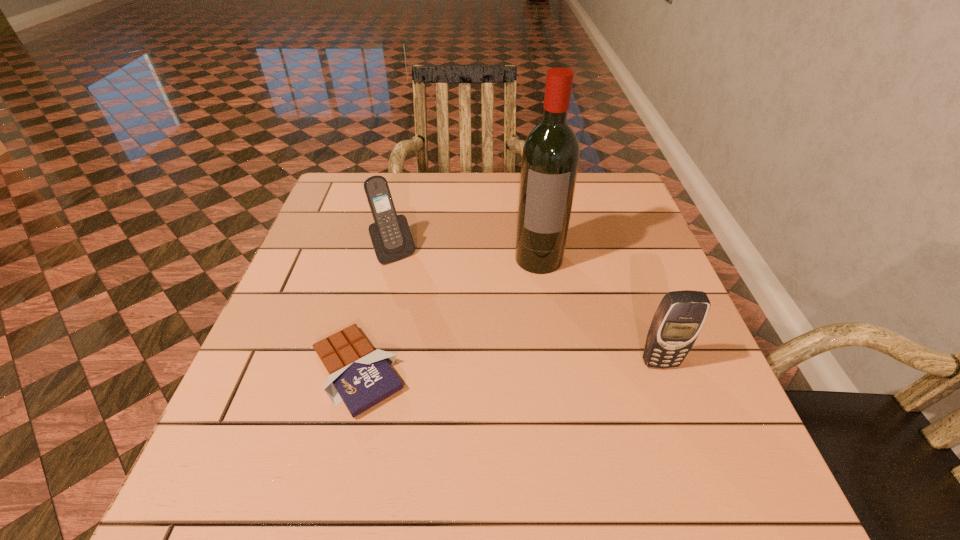
Locate an element on the screen. vacant space on the desktop that is between the chocolate bar and the right cellular telephone and is positioned on the label of the tallest object is located at coordinates (531, 366).

Where is `vacant spot on the desktop that is between the shortest object and the nearer cellular telephone and is positioned on the front-facing side of the farther cellular telephone`? This screenshot has height=540, width=960. vacant spot on the desktop that is between the shortest object and the nearer cellular telephone and is positioned on the front-facing side of the farther cellular telephone is located at coordinates (477, 367).